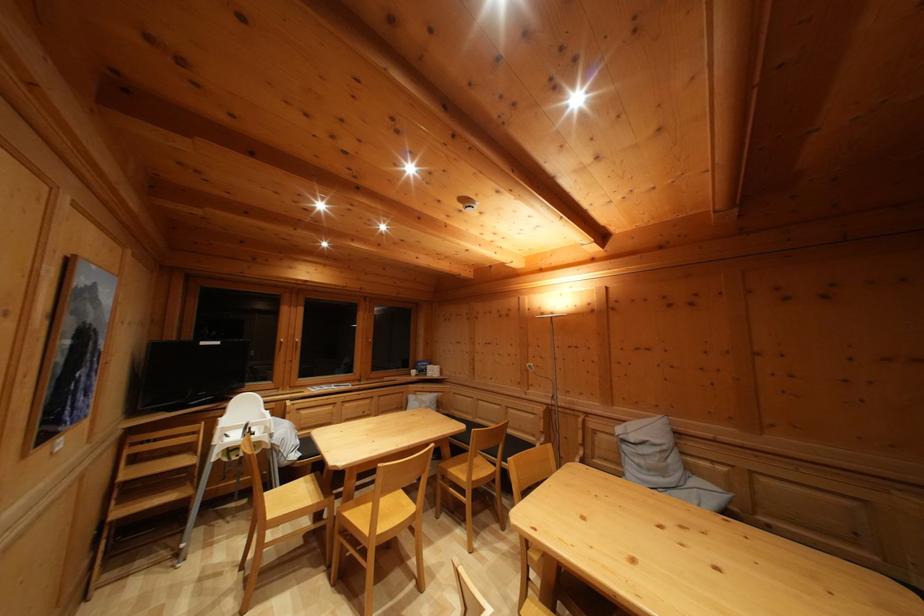
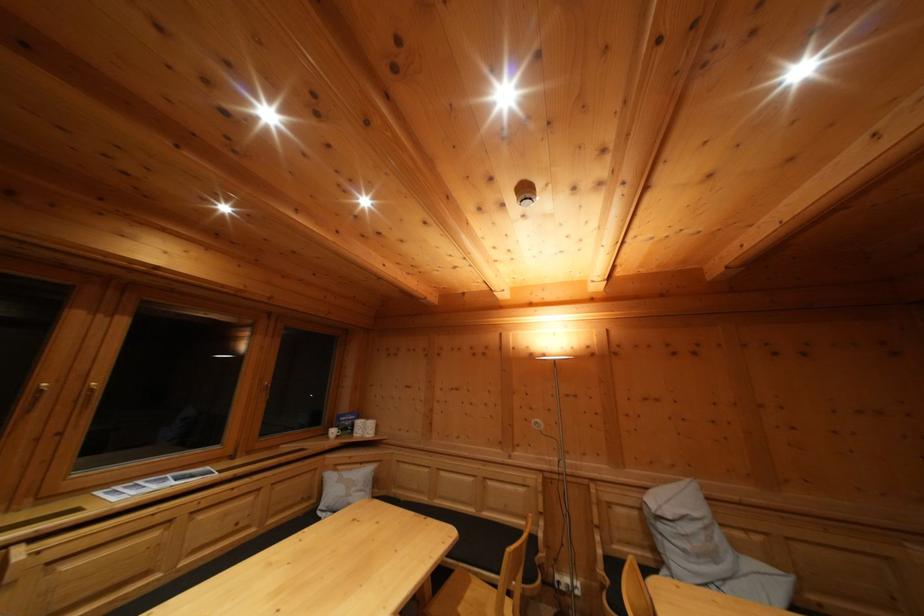
The point at (436, 399) is marked in the first image. Where is the corresponding point in the second image?

(368, 469)